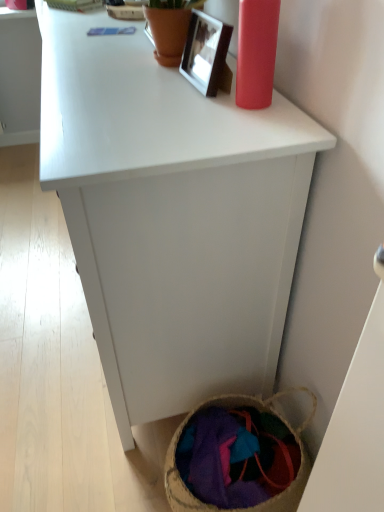
Question: Is textured woven basket at lower right located within white matte cabinet at center?

Choices:
 (A) yes
 (B) no

Answer: (B)

Question: From a real-world perspective, is white matte cabinet at center located beneath textured woven basket at lower right?

Choices:
 (A) yes
 (B) no

Answer: (B)

Question: From the image's perspective, does white matte cabinet at center appear lower than textured woven basket at lower right?

Choices:
 (A) no
 (B) yes

Answer: (A)

Question: Is white matte cabinet at center at the left side of textured woven basket at lower right?

Choices:
 (A) no
 (B) yes

Answer: (B)

Question: Is white matte cabinet at center not close to textured woven basket at lower right?

Choices:
 (A) yes
 (B) no

Answer: (B)

Question: Visually, is textured woven basket at lower right positioned to the left or to the right of white matte cabinet at center?

Choices:
 (A) left
 (B) right

Answer: (B)

Question: From a real-world perspective, is textured woven basket at lower right physically located above or below white matte cabinet at center?

Choices:
 (A) above
 (B) below

Answer: (B)

Question: In terms of size, does textured woven basket at lower right appear bigger or smaller than white matte cabinet at center?

Choices:
 (A) big
 (B) small

Answer: (B)

Question: From their relative heights in the image, would you say textured woven basket at lower right is taller or shorter than white matte cabinet at center?

Choices:
 (A) tall
 (B) short

Answer: (B)

Question: Is white matte cabinet at center to the left or to the right of textured woven basket at lower right in the image?

Choices:
 (A) right
 (B) left

Answer: (B)

Question: From a real-world perspective, relative to textured woven basket at lower right, is white matte cabinet at center vertically above or below?

Choices:
 (A) above
 (B) below

Answer: (A)

Question: Relative to textured woven basket at lower right, is white matte cabinet at center in front or behind?

Choices:
 (A) behind
 (B) front

Answer: (B)

Question: Would you say white matte cabinet at center is inside or outside textured woven basket at lower right?

Choices:
 (A) inside
 (B) outside

Answer: (B)

Question: Considering the positions of point (165, 237) and point (190, 47), is point (165, 237) closer or farther from the camera than point (190, 47)?

Choices:
 (A) farther
 (B) closer

Answer: (B)

Question: Is white matte cabinet at center to the left or to the right of metallic silver picture frame at upper center in the image?

Choices:
 (A) left
 (B) right

Answer: (A)